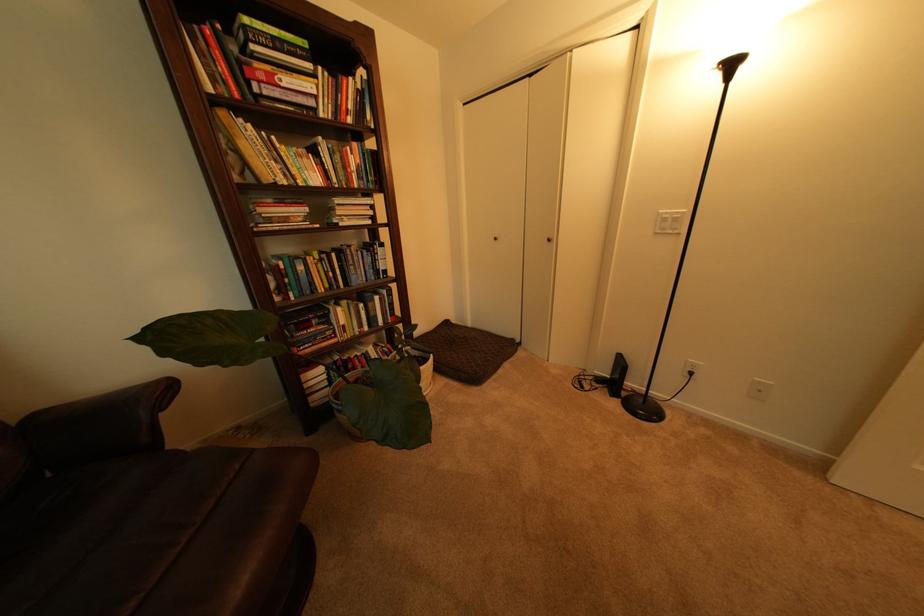
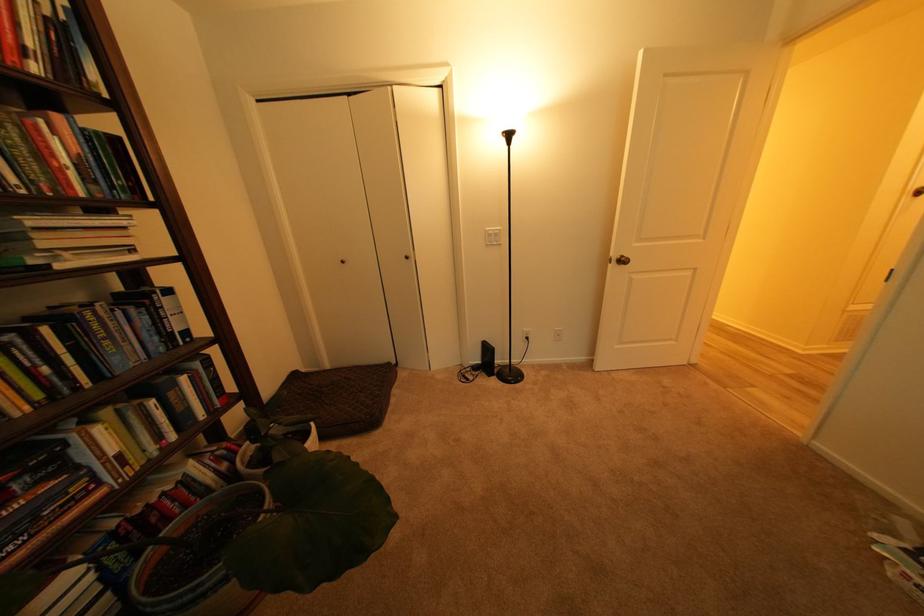
Locate, in the second image, the point that corresponds to point (368, 166) in the first image.

(84, 156)